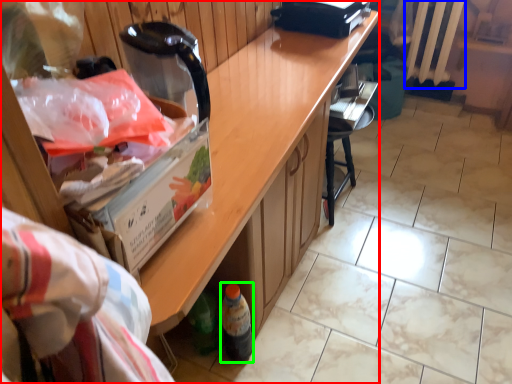
Question: Which object is positioned closest to cabinetry (highlighted by a red box)? Select from radiator (highlighted by a blue box) and bottle (highlighted by a green box).

Choices:
 (A) radiator
 (B) bottle

Answer: (B)